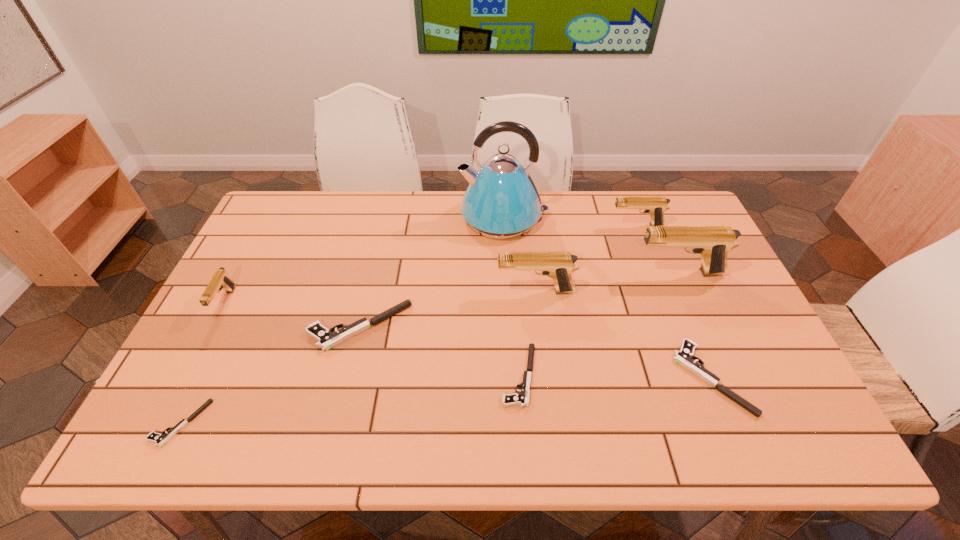
Where is `free space at the near right corner of the desktop`? free space at the near right corner of the desktop is located at coordinates (745, 437).

Where is `vacant point located between the farthest tan pistol and the sixth tallest object`? The height and width of the screenshot is (540, 960). vacant point located between the farthest tan pistol and the sixth tallest object is located at coordinates (498, 276).

Locate an element on the screen. This screenshot has height=540, width=960. empty space between the leftmost tan pistol and the third tan pistol from right to left is located at coordinates pos(380,296).

The width and height of the screenshot is (960, 540). Find the location of `free space between the seventh tallest object and the smallest tan pistol`. free space between the seventh tallest object and the smallest tan pistol is located at coordinates (468, 340).

Where is `free spot between the leftmost black pistol and the kettle`? The width and height of the screenshot is (960, 540). free spot between the leftmost black pistol and the kettle is located at coordinates (342, 320).

What are the coordinates of `vacant space that is in between the third farthest object and the third black pistol from right to left` in the screenshot? It's located at (518, 300).

Image resolution: width=960 pixels, height=540 pixels. Find the location of `free space between the second tallest pistol and the smallest tan pistol`. free space between the second tallest pistol and the smallest tan pistol is located at coordinates (380, 296).

At what (x,y) coordinates should I click in order to perform the action: click on vacant point located between the seventh nearest object and the smallest black pistol. Please return your answer as a coordinate pair (x, y). Looking at the image, I should click on (429, 348).

Find the location of a particular element. unoccupied area between the kettle and the shortest object is located at coordinates (342, 320).

Identify the location of free space between the third biggest black pistol and the kettle. tap(512, 296).